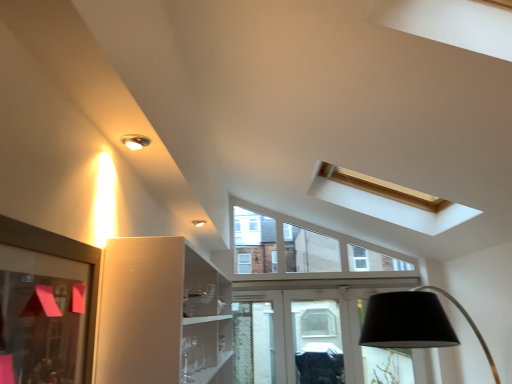
Question: Is matte silver light fixture at upper left outside of matte glass picture frame at left?

Choices:
 (A) yes
 (B) no

Answer: (A)

Question: Is the position of matte silver light fixture at upper left more distant than that of matte glass picture frame at left?

Choices:
 (A) no
 (B) yes

Answer: (B)

Question: Does matte silver light fixture at upper left have a greater width compared to matte glass picture frame at left?

Choices:
 (A) no
 (B) yes

Answer: (B)

Question: From the image's perspective, is matte silver light fixture at upper left beneath matte glass picture frame at left?

Choices:
 (A) yes
 (B) no

Answer: (B)

Question: Is the position of matte silver light fixture at upper left less distant than that of matte glass picture frame at left?

Choices:
 (A) yes
 (B) no

Answer: (B)

Question: From a real-world perspective, is matte silver light fixture at upper left over matte glass picture frame at left?

Choices:
 (A) no
 (B) yes

Answer: (B)

Question: Is matte glass picture frame at left closer to camera compared to matte silver light fixture at upper left?

Choices:
 (A) yes
 (B) no

Answer: (A)

Question: Would you say matte glass picture frame at left is a long distance from matte silver light fixture at upper left?

Choices:
 (A) no
 (B) yes

Answer: (A)

Question: Does matte glass picture frame at left have a larger size compared to matte silver light fixture at upper left?

Choices:
 (A) no
 (B) yes

Answer: (B)

Question: From the image's perspective, is matte glass picture frame at left on top of matte silver light fixture at upper left?

Choices:
 (A) no
 (B) yes

Answer: (A)

Question: Can you confirm if matte glass picture frame at left is shorter than matte silver light fixture at upper left?

Choices:
 (A) no
 (B) yes

Answer: (A)

Question: Are matte glass picture frame at left and matte silver light fixture at upper left beside each other?

Choices:
 (A) no
 (B) yes

Answer: (A)

Question: In terms of size, does matte glass picture frame at left appear bigger or smaller than matte silver light fixture at upper left?

Choices:
 (A) small
 (B) big

Answer: (B)